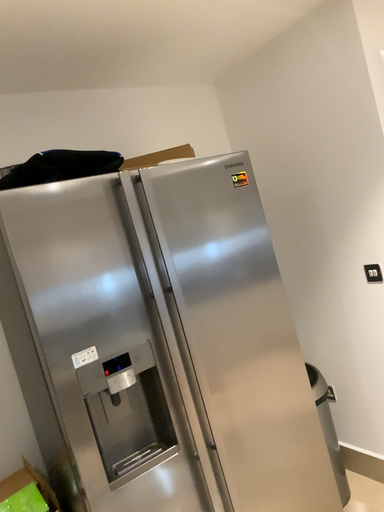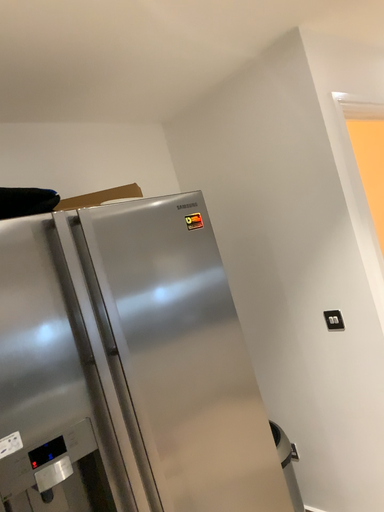
Question: How did the camera likely rotate when shooting the video?

Choices:
 (A) rotated left
 (B) rotated right

Answer: (B)